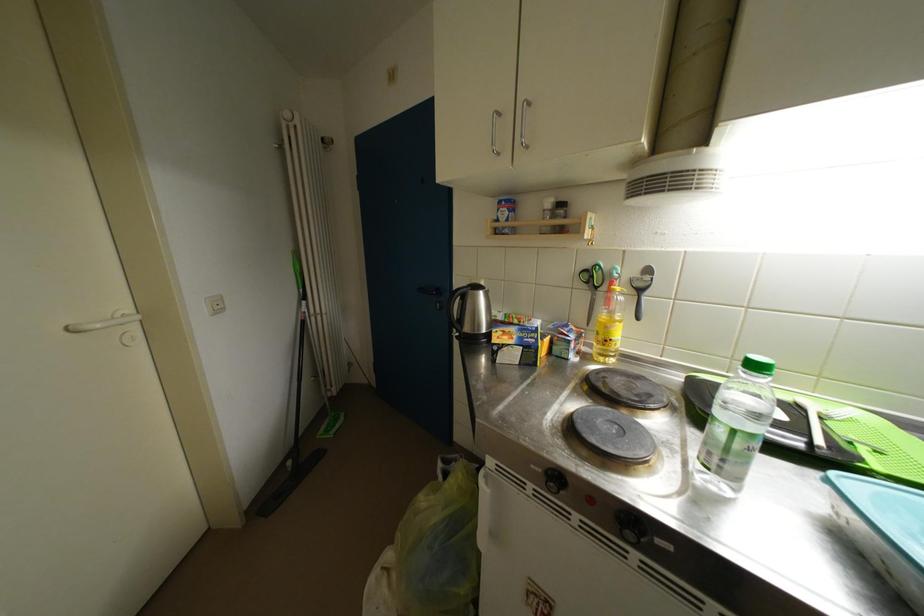
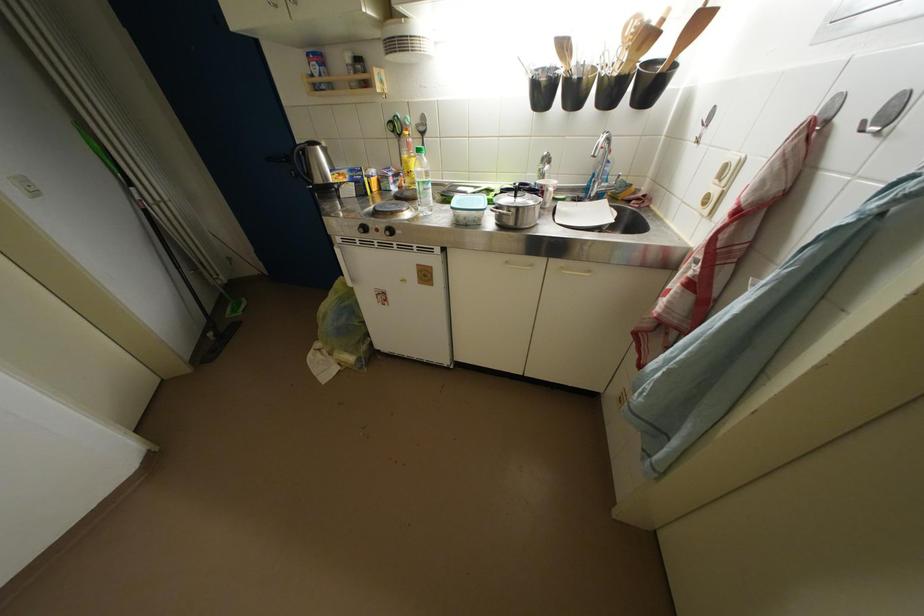
In the second image, find the point that corresponds to the point at 488,297 in the first image.

(324, 152)